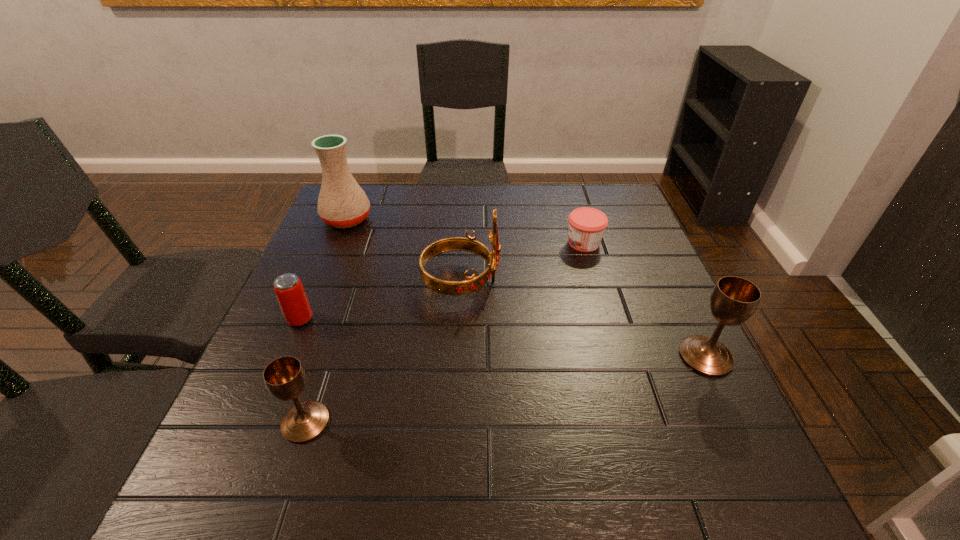
In order to click on object that is at the near edge in this screenshot , I will do `click(285, 378)`.

At what (x,y) coordinates should I click in order to perform the action: click on chalice present at the left edge. Please return your answer as a coordinate pair (x, y). Looking at the image, I should click on (285, 378).

Locate an element on the screen. The width and height of the screenshot is (960, 540). pottery that is at the left edge is located at coordinates (342, 203).

You are a GUI agent. You are given a task and a screenshot of the screen. Output one action in this format:
    pyautogui.click(x=<x>, y=<y>)
    Task: Click on the beer can that is at the left edge
    The image size is (960, 540).
    Given the screenshot: What is the action you would take?
    pyautogui.click(x=288, y=288)

Locate an element on the screen. chalice that is at the right edge is located at coordinates (733, 300).

In order to click on jam at the right edge in this screenshot , I will do `click(587, 225)`.

This screenshot has width=960, height=540. In order to click on object positioned at the far left corner in this screenshot , I will do `click(342, 203)`.

You are a GUI agent. You are given a task and a screenshot of the screen. Output one action in this format:
    pyautogui.click(x=<x>, y=<y>)
    Task: Click on the object present at the near left corner
    This screenshot has width=960, height=540.
    Given the screenshot: What is the action you would take?
    pyautogui.click(x=285, y=378)

Image resolution: width=960 pixels, height=540 pixels. I want to click on vacant region at the far edge, so click(491, 207).

Identify the location of vacant region at the left edge of the desktop. (341, 274).